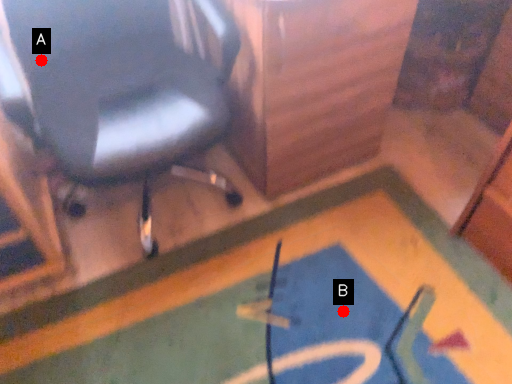
Question: Two points are circled on the image, labeled by A and B beside each circle. Which of the following is the farthest from the observer?

Choices:
 (A) A is further
 (B) B is further

Answer: (A)